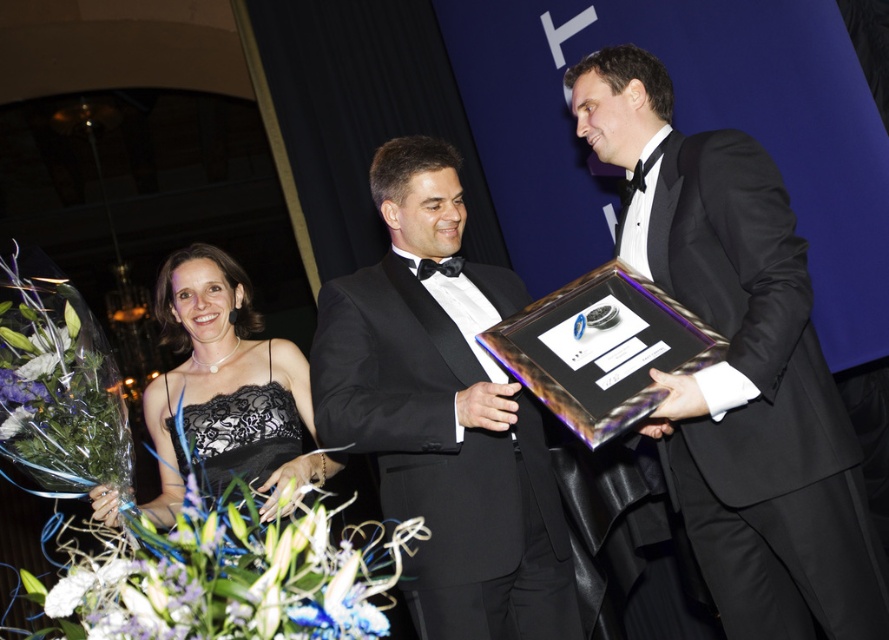
Question: Which point is closer to the camera taking this photo?

Choices:
 (A) (425, 307)
 (B) (207, 480)
 (C) (638, 77)

Answer: (A)

Question: Among these objects, which one is farthest from the camera?

Choices:
 (A) black lace dress at lower left
 (B) shiny black tuxedo at center
 (C) black lace cocktail dress at center
 (D) black satin tuxedo at center

Answer: (C)

Question: Is the position of shiny black tuxedo at center more distant than that of black satin tuxedo at center?

Choices:
 (A) no
 (B) yes

Answer: (A)

Question: Based on their relative distances, which object is farther from the black lace cocktail dress at center?

Choices:
 (A) black satin tuxedo at center
 (B) shiny black tuxedo at center

Answer: (B)

Question: Is shiny black tuxedo at center wider than black lace cocktail dress at center?

Choices:
 (A) no
 (B) yes

Answer: (B)

Question: Observing the image, what is the correct spatial positioning of black satin tuxedo at center in reference to black lace cocktail dress at center?

Choices:
 (A) above
 (B) below

Answer: (A)